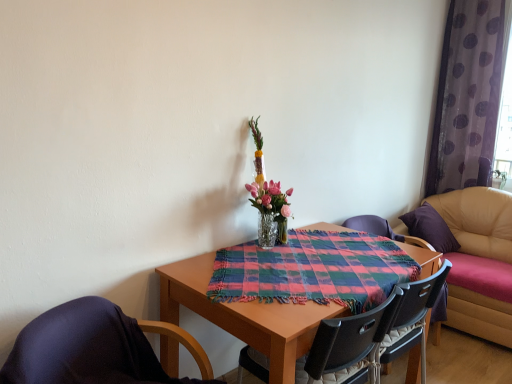
Question: Visually, is black plastic chair at center, the 3th chair in the left-to-right sequence, positioned to the left or to the right of plaid fabric at center?

Choices:
 (A) left
 (B) right

Answer: (B)

Question: Is black plastic chair at center, which is the 1th chair in back-to-front order, wider or thinner than plaid fabric at center?

Choices:
 (A) thin
 (B) wide

Answer: (A)

Question: Which object is the farthest from the purple sheer curtain at right?

Choices:
 (A) purple fabric-covered chair at lower left, which appears as the 3th chair when viewed from the right
 (B) black plastic chair at center, which is the 1th chair in back-to-front order
 (C) leather couch at right
 (D) plaid fabric at center
 (E) black plastic chair at center, the 2th chair in the left-to-right sequence

Answer: (A)

Question: Which is nearer to the leather couch at right?

Choices:
 (A) clear glass vase at center
 (B) purple sheer curtain at right
 (C) black plastic chair at center, which is the 2th chair in back-to-front order
 (D) black plastic chair at center, the third chair viewed from the front
 (E) purple fabric-covered chair at lower left, which is the 3th chair in back-to-front order

Answer: (B)